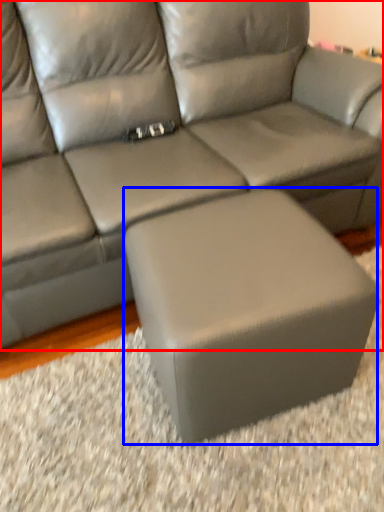
Question: Which point is further to the camera, studio couch (highlighted by a red box) or stool (highlighted by a blue box)?

Choices:
 (A) studio couch
 (B) stool

Answer: (B)